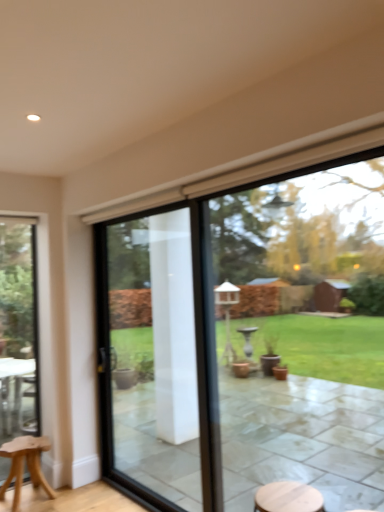
Find the location of `vacant region above light brown wooden stool at lower left (from a real-world perspective)`. vacant region above light brown wooden stool at lower left (from a real-world perspective) is located at coordinates (21, 444).